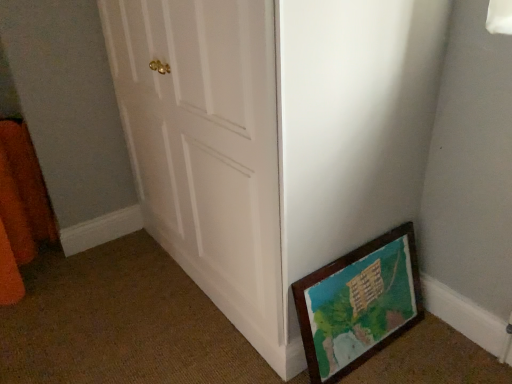
Image resolution: width=512 pixels, height=384 pixels. What are the coordinates of `vacant space that is to the left of white wooden door at center` in the screenshot? It's located at (111, 296).